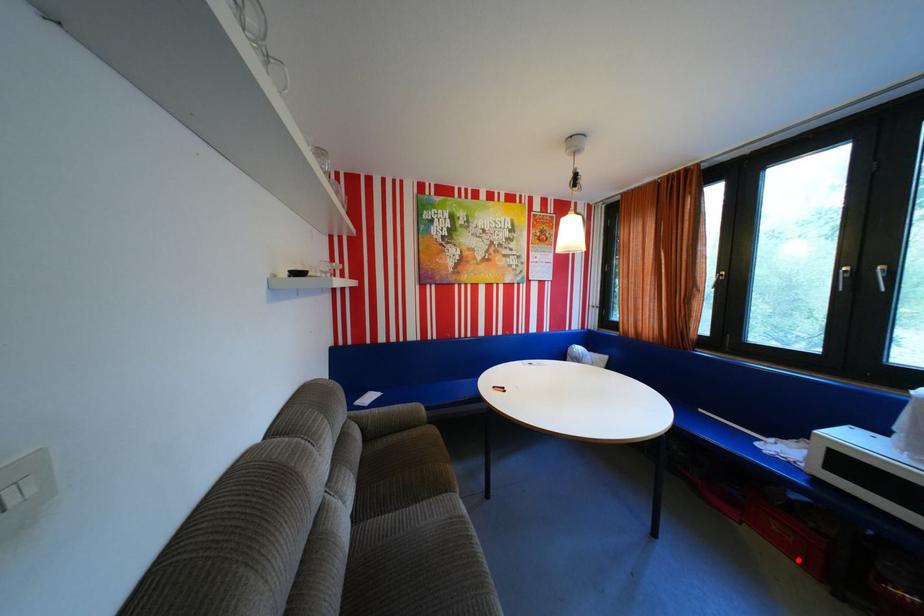
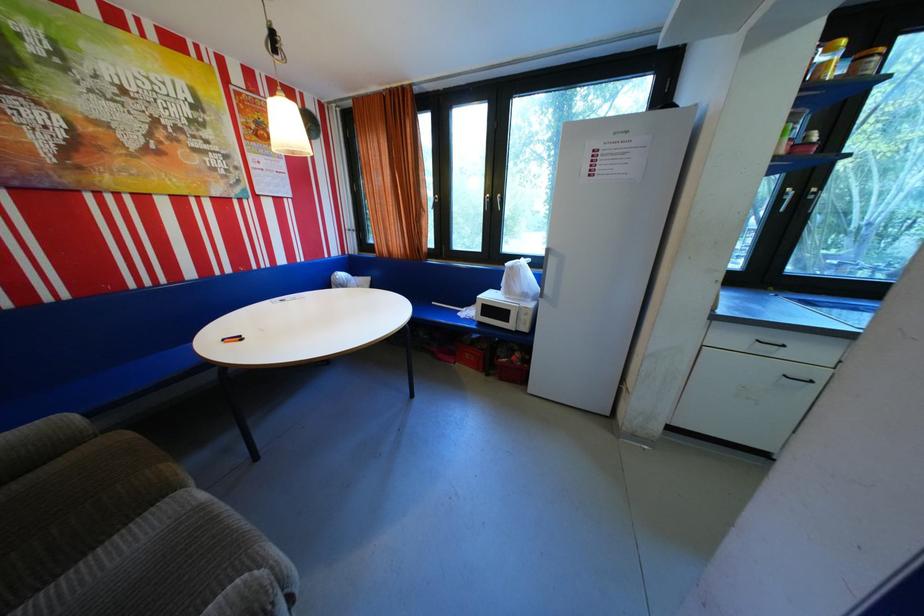
Locate, in the second image, the point that corresponds to the highlighted location in the first image.

(483, 370)